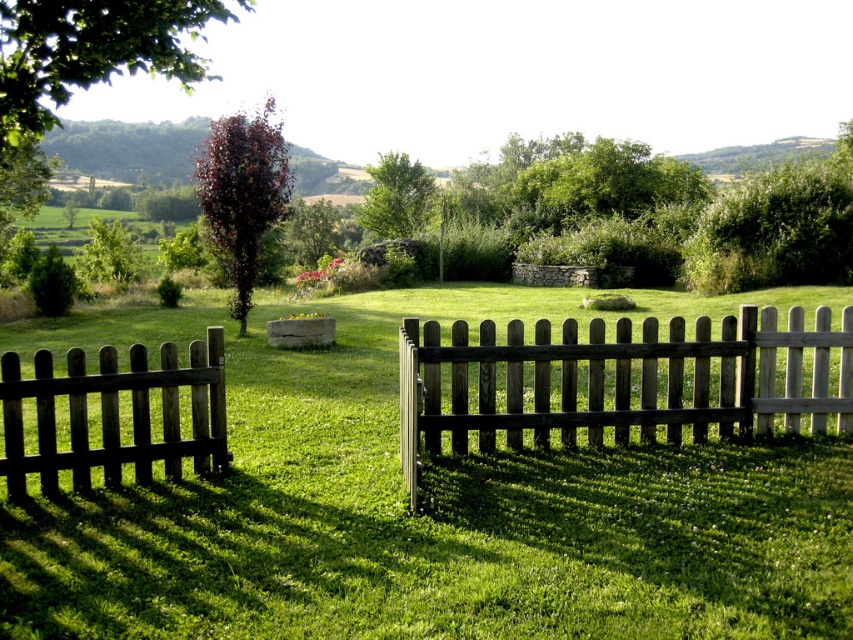
Is brown wooden fence at left shorter than dark purple leafy tree at center?

Yes.

Between brown wooden fence at left and dark purple leafy tree at center, which one appears on the right side from the viewer's perspective?

brown wooden fence at left

Which is in front, point (111, 477) or point (276, 198)?

Point (111, 477) is more forward.

What are the coordinates of `brown wooden fence at left` in the screenshot? It's located at (115, 413).

Does wooden picket fence at center appear on the left side of green leafy tree at upper left?

In fact, wooden picket fence at center is to the right of green leafy tree at upper left.

Is point (674, 429) more distant than point (189, 61)?

Yes, point (674, 429) is behind point (189, 61).

Identify the location of wooden picket fence at center. (618, 381).

Can you confirm if dark purple leafy tree at center is bigger than green leafy tree at center?

Correct, dark purple leafy tree at center is larger in size than green leafy tree at center.

Does point (235, 125) come in front of point (418, 225)?

Yes, point (235, 125) is in front of point (418, 225).

Locate an element on the screen. The image size is (853, 640). dark purple leafy tree at center is located at coordinates (242, 193).